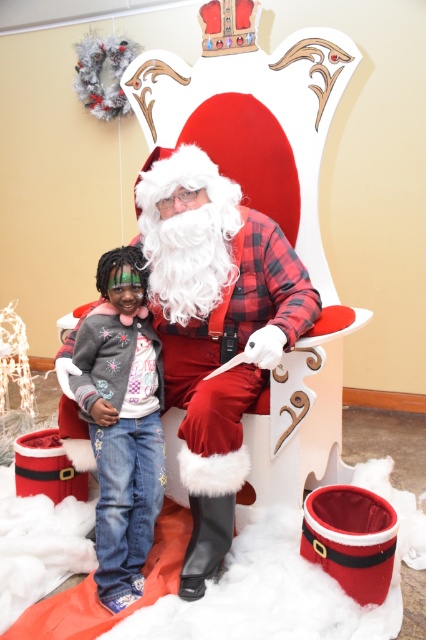
You are standing in the festive scene and want to walk from the point at coordinates point (278, 282) to the point at coordinates point (140, 452). Which direction should you move to get closer to your destination?

To move from point (278, 282) to point (140, 452), you should move towards the upper right direction since point (140, 452) is located in the upper right relative to point (278, 282).

You are standing in front of Santa Claus at the festive event. You notice a specific point marked at coordinates (215, 330). What does this point correspond to on Santa?

The point at (215, 330) corresponds to Santa Claus fuzzy white beard at center.